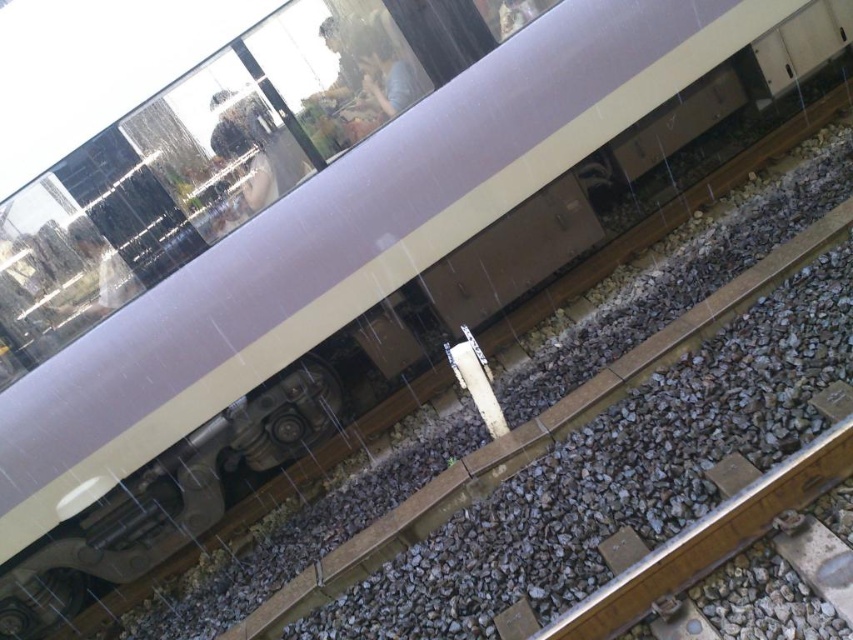
You are a passenger sitting inside the train and want to look outside through the transparent glass train window at upper center. Where should you look relative to your current position?

You should look towards the upper center direction to see through the transparent glass train window at upper center.

You are a passenger on the train and want to look outside through the transparent glass train window at upper center. However, there is gray gravel at lower right in your way. Can you move to the window without stepping on the gravel?

The transparent glass train window at upper center might be wider than gray gravel at lower right, so there might be enough space to move to the window without stepping on the gravel.

You are a passenger sitting inside the train and looking out through the transparent glass train window at upper center. You notice gray gravel at lower right in your line of sight. Which object is closer to you, the passenger?

The transparent glass train window at upper center is closer to you than the gray gravel at lower right because it is further to the viewer, meaning it appears nearer in your line of sight.